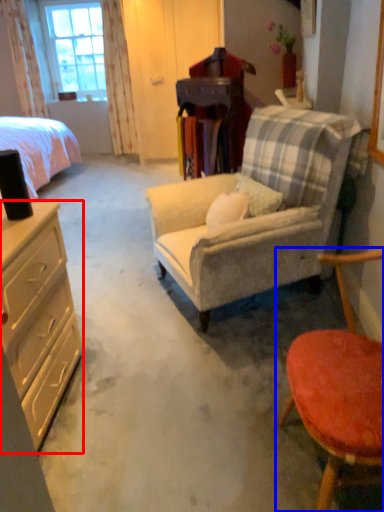
Question: Which of the following is the closest to the observer, desk (highlighted by a red box) or chair (highlighted by a blue box)?

Choices:
 (A) desk
 (B) chair

Answer: (B)